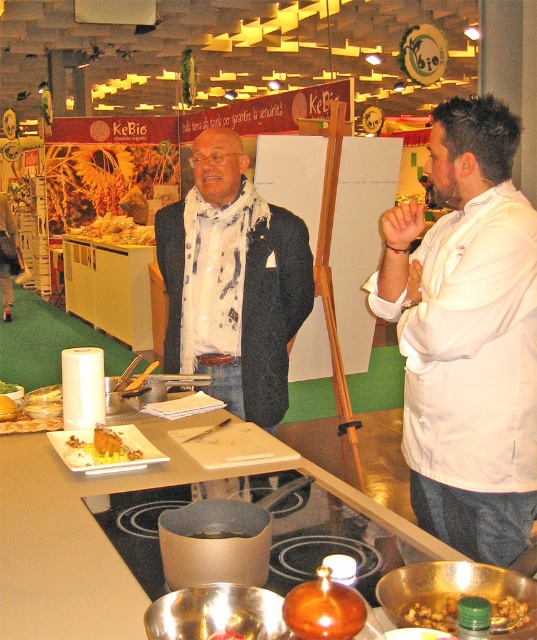
Question: Among these points, which one is farthest from the camera?

Choices:
 (A) (5, 381)
 (B) (492, 625)
 (C) (204, 310)

Answer: (A)

Question: Can you confirm if dark gray woolen jacket at center is positioned to the right of brown matte nuts at lower right?

Choices:
 (A) no
 (B) yes

Answer: (A)

Question: From the image, what is the correct spatial relationship of brown matte nuts at lower right in relation to golden brown bread at center?

Choices:
 (A) right
 (B) left

Answer: (A)

Question: Among these points, which one is farthest from the camera?

Choices:
 (A) (43, 412)
 (B) (4, 385)

Answer: (B)

Question: Can you confirm if brown matte nuts at lower right is positioned to the left of golden crispy pastry at center?

Choices:
 (A) yes
 (B) no

Answer: (B)

Question: Which of these objects is positioned closest to the dark gray woolen jacket at center?

Choices:
 (A) golden brown cake at center
 (B) golden brown bread at center
 (C) brown matte nuts at lower right

Answer: (A)